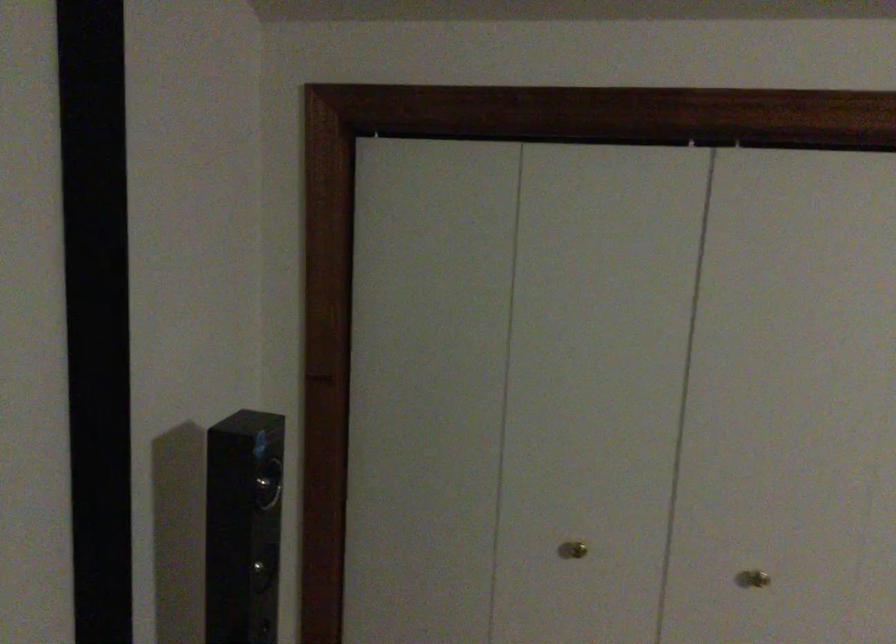
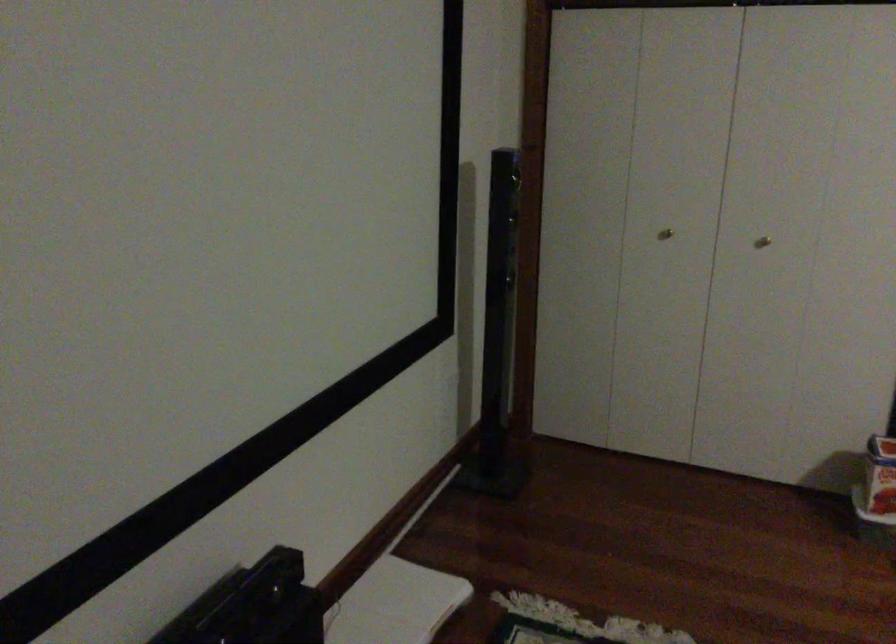
Question: In a continuous first-person perspective shot, in which direction is the camera moving?

Choices:
 (A) Left
 (B) Right
 (C) Forward
 (D) Backward

Answer: (D)